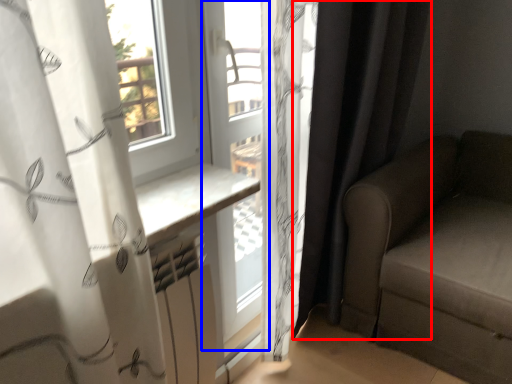
Question: Which of the following is the farthest to the observer, curtain (highlighted by a red box) or window frame (highlighted by a blue box)?

Choices:
 (A) curtain
 (B) window frame

Answer: (B)